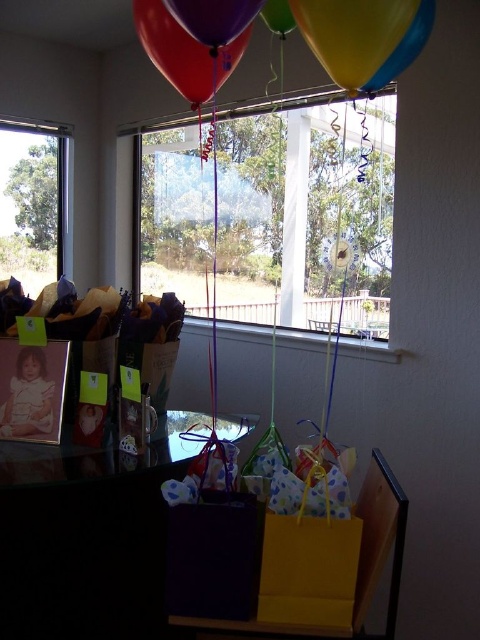
Question: Which point is closer to the camera taking this photo?

Choices:
 (A) (288, 13)
 (B) (217, 13)
 (C) (420, 38)
 (D) (168, 29)

Answer: (B)

Question: Is clear glass window at upper left wider than shiny blue balloon at upper right?

Choices:
 (A) no
 (B) yes

Answer: (B)

Question: Is matte black table at lower center smaller than clear glass window at upper left?

Choices:
 (A) no
 (B) yes

Answer: (A)

Question: Observing the image, what is the correct spatial positioning of transparent glass window at center in reference to clear glass window at upper left?

Choices:
 (A) left
 (B) right

Answer: (B)

Question: Which object appears farthest from the camera in this image?

Choices:
 (A) clear glass window at upper left
 (B) shiny purple balloon at upper center

Answer: (A)

Question: Among these objects, which one is farthest from the camera?

Choices:
 (A) shiny blue balloon at upper right
 (B) shiny metallic balloons at upper center

Answer: (A)